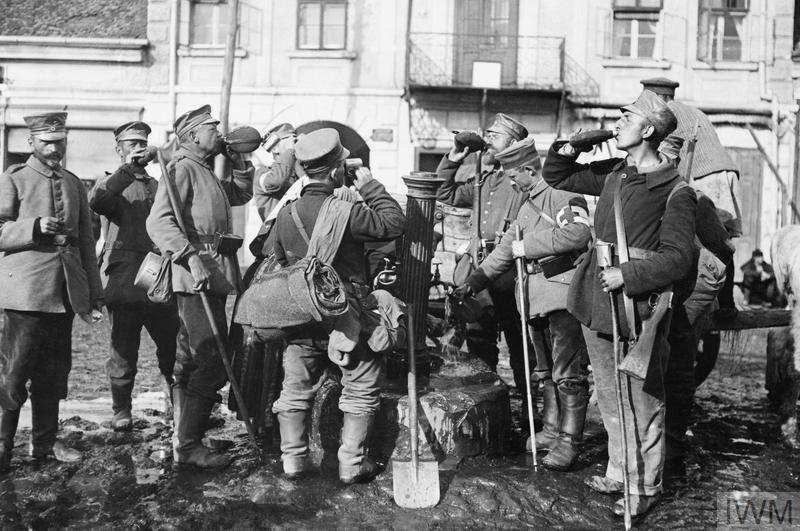
Identify the location of window. This screenshot has width=800, height=531. (330, 40).